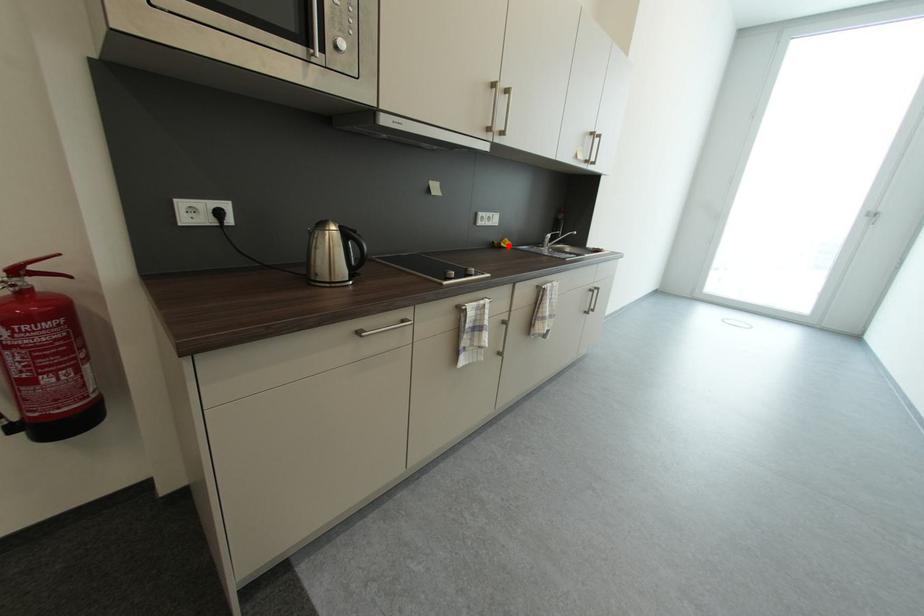
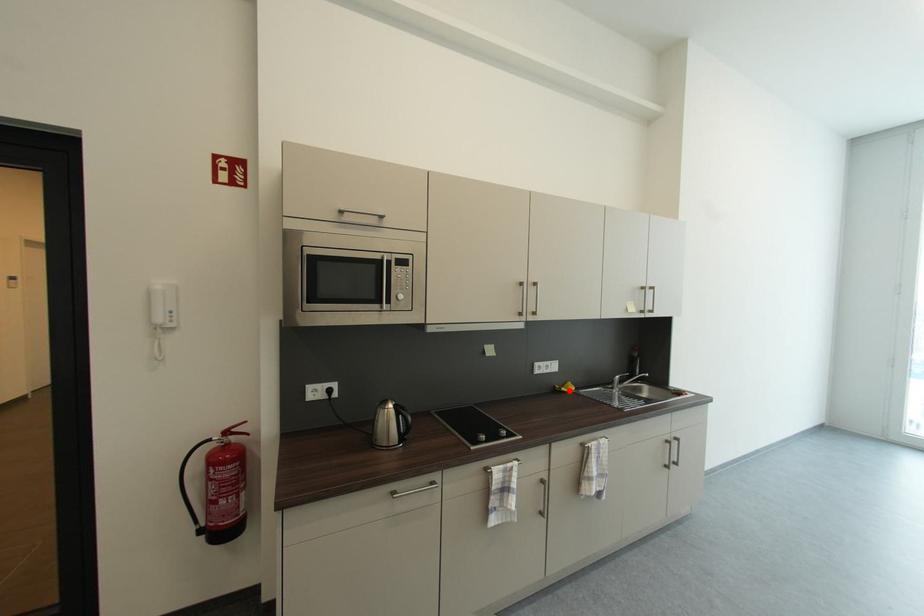
I am providing you with two images of the same scene from different viewpoints. A red point is marked on the first image and another point is marked on the second image. Do the highlighted points in image1 and image2 indicate the same real-world spot?

Yes